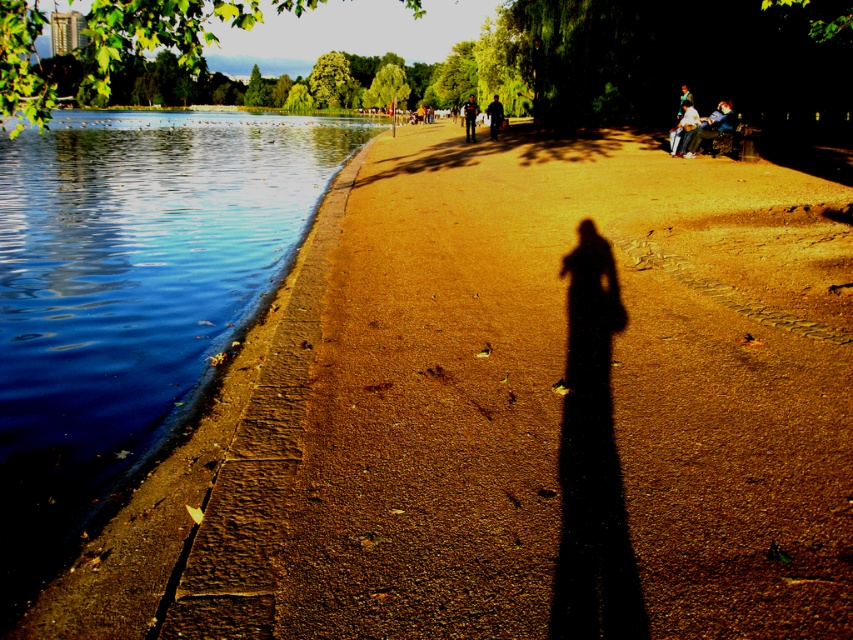
You are standing at the edge of the lake and see two points marked on the pathway. The first point is at coordinate point [682,147] and the second point is at coordinate point [680,113]. Which point is closer to you as you face the lake?

Point [682,147] is in front of point [680,113], so it is closer to you as you face the lake.

You are standing on the lakeside pathway and notice two points marked on the ground. The first point is at coordinates point (722, 124), and the second point is at point (676, 115). Which of these two points is closer to your current position?

Point (722, 124) is closer to the viewer than point (676, 115), so the first point is closer to your current position.

You are a hiker who just arrived at the lakeside and see the blue denim jeans at upper right and the blue denim jeans at right. Which pair of jeans is positioned more to the left side of the image?

The blue denim jeans at upper right is positioned to the left of the blue denim jeans at right, so the blue denim jeans at upper right is more to the left side of the image.